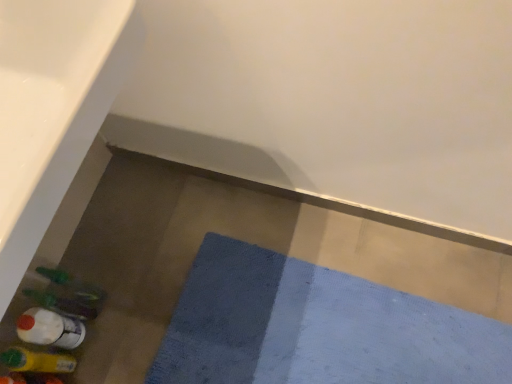
I want to click on vacant area that lies between translucent plastic bottle at lower left, marked as the 1th bottle in a bottom-to-top arrangement, and blue textured bath mat at lower center, so click(x=139, y=315).